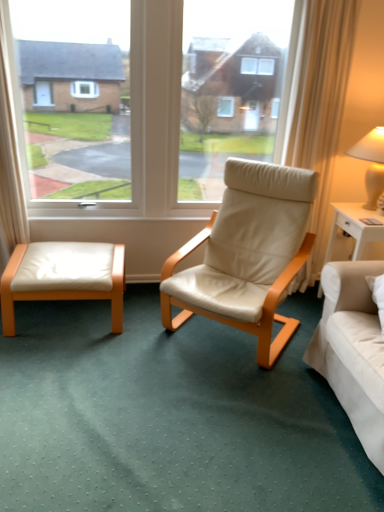
Identify the location of vacant area that is situated to the right of white leather ottoman at lower left. (162, 336).